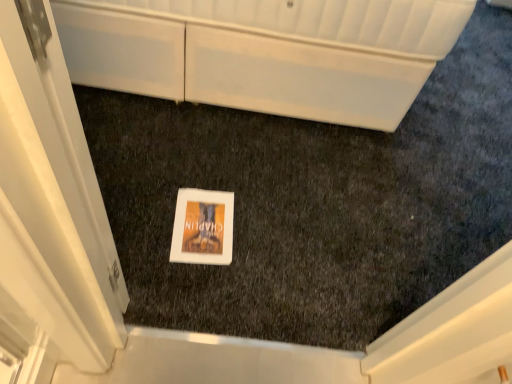
Find the location of a particular element. This screenshot has height=384, width=512. vacant space that is in between white glossy door at center and white glossy cabinet at upper center is located at coordinates (211, 172).